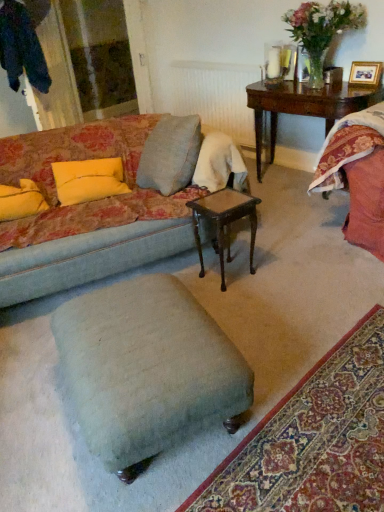
I want to click on blank space above light blue fabric stool at center (from a real-world perspective), so [141, 326].